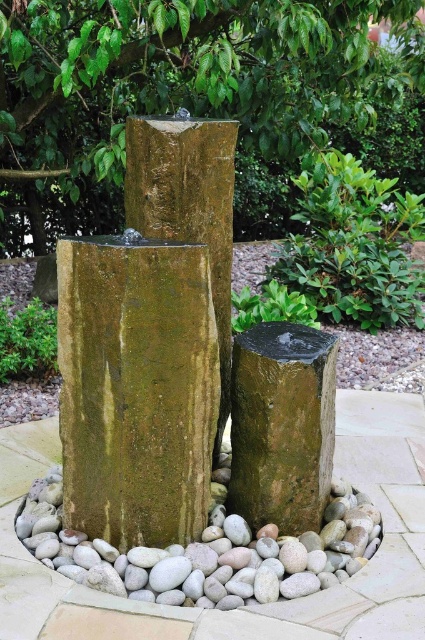
You are a gardener trying to place a decorative statue that is 12 inches wide between the green mossy stone at center and the green mossy stump at center. Can you fit it there?

The distance between the green mossy stone at center and the green mossy stump at center is 12.49 inches. Since the statue is 12 inches wide, it can fit as the space is slightly larger than the statue.

You are standing at the center of the circular pebble arrangement around the fountain. You want to place a decorative statue exactly at the center of the green mossy stone at center. Can you determine the coordinates where you should place the statue?

The coordinates for the green mossy stone at center are at point (150,340), so you should place the statue at those coordinates.

You are standing at the edge of the fountain and want to place a decorative statue that is 10 feet wide between the green mossy rock at center and the middle tier of the fountain. Can you fit it there?

The distance between the green mossy rock at center and the middle tier of the fountain is 13.61 feet. Since the statue is 10 feet wide, it can fit as there is enough space.